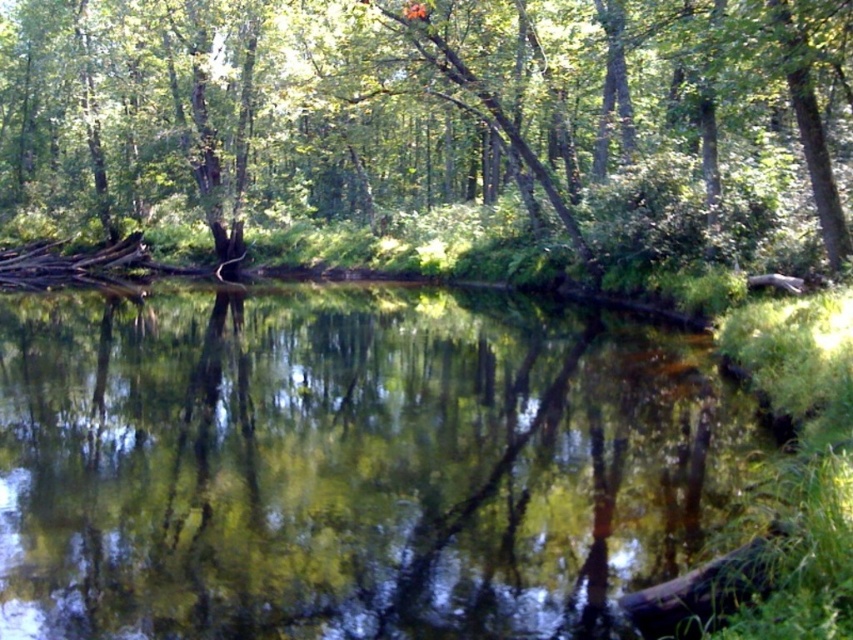
Question: Which point appears farthest from the camera in this image?

Choices:
 (A) (347, 300)
 (B) (247, 179)

Answer: (B)

Question: Which point is closer to the camera taking this photo?

Choices:
 (A) tap(167, 16)
 (B) tap(519, 513)

Answer: (B)

Question: Is green reflective water at center further to camera compared to green leafy tree at center?

Choices:
 (A) no
 (B) yes

Answer: (A)

Question: Can you confirm if green reflective water at center is thinner than green leafy tree at center?

Choices:
 (A) yes
 (B) no

Answer: (A)

Question: Is green reflective water at center thinner than green leafy tree at center?

Choices:
 (A) yes
 (B) no

Answer: (A)

Question: Which point is farther from the camera taking this photo?

Choices:
 (A) (328, 417)
 (B) (718, 237)

Answer: (B)